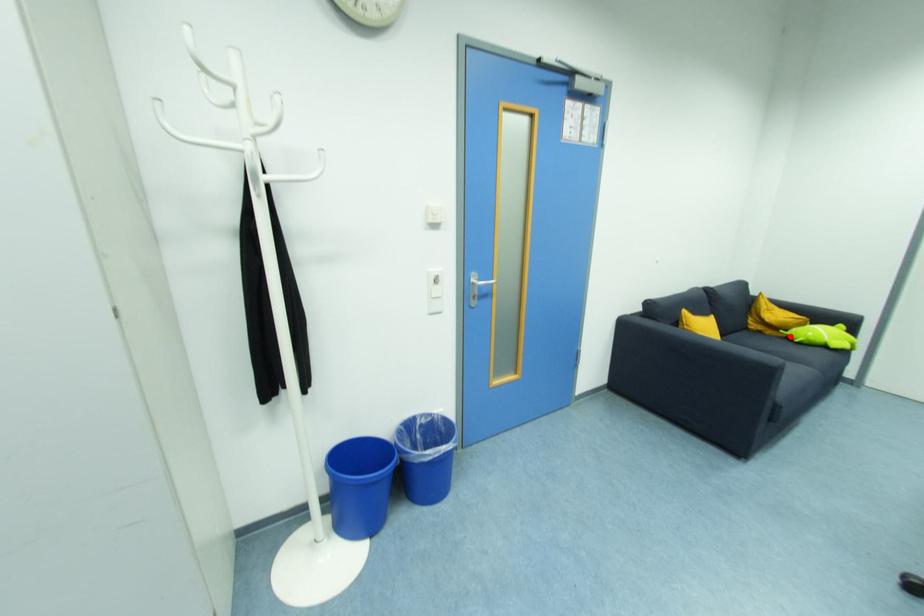
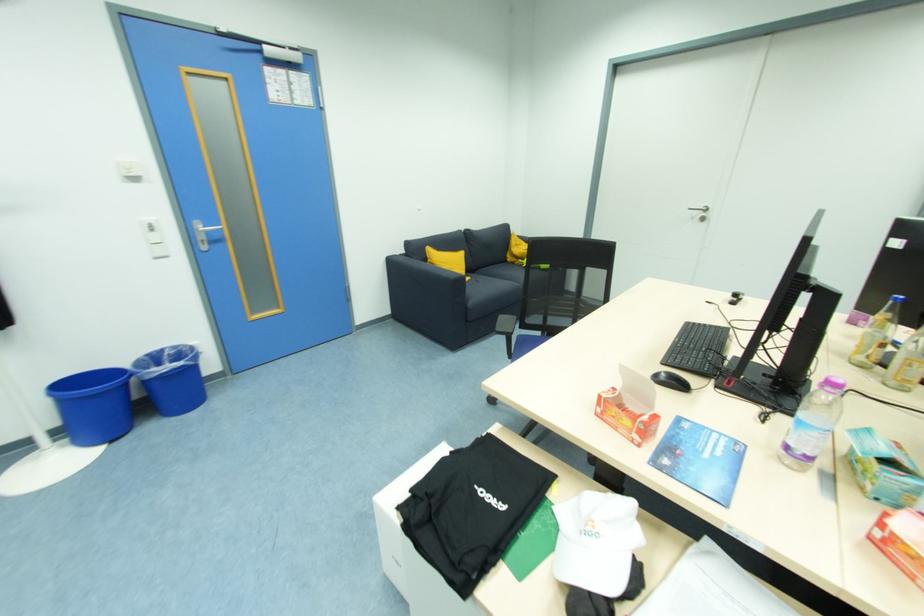
In the second image, find the point that corresponds to the highlighted location in the first image.

(526, 264)